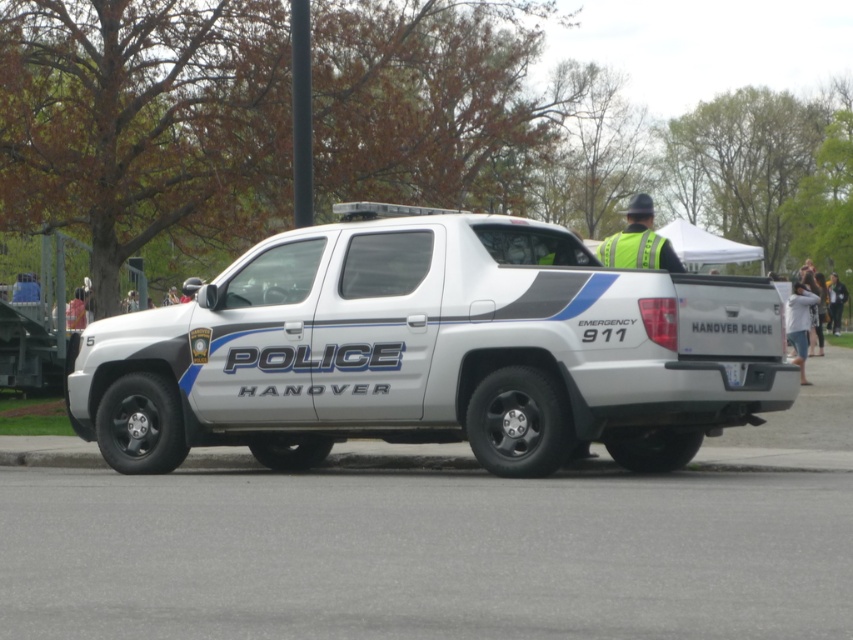
Question: Is white glossy police car at center further to camera compared to white plastic license plate at rear?

Choices:
 (A) yes
 (B) no

Answer: (B)

Question: Can you confirm if white glossy police car at center is wider than white plastic license plate at rear?

Choices:
 (A) no
 (B) yes

Answer: (B)

Question: Can you confirm if white glossy police car at center is thinner than white plastic license plate at rear?

Choices:
 (A) yes
 (B) no

Answer: (B)

Question: Estimate the real-world distances between objects in this image. Which object is farther from the white plastic license plate at rear?

Choices:
 (A) white glossy police car at center
 (B) yellow reflective vest at upper right

Answer: (A)

Question: Which point is farther to the camera?

Choices:
 (A) click(724, 368)
 (B) click(296, 401)

Answer: (B)

Question: Which object is positioned farthest from the white plastic license plate at rear?

Choices:
 (A) yellow reflective vest at upper right
 (B) white glossy police car at center

Answer: (B)